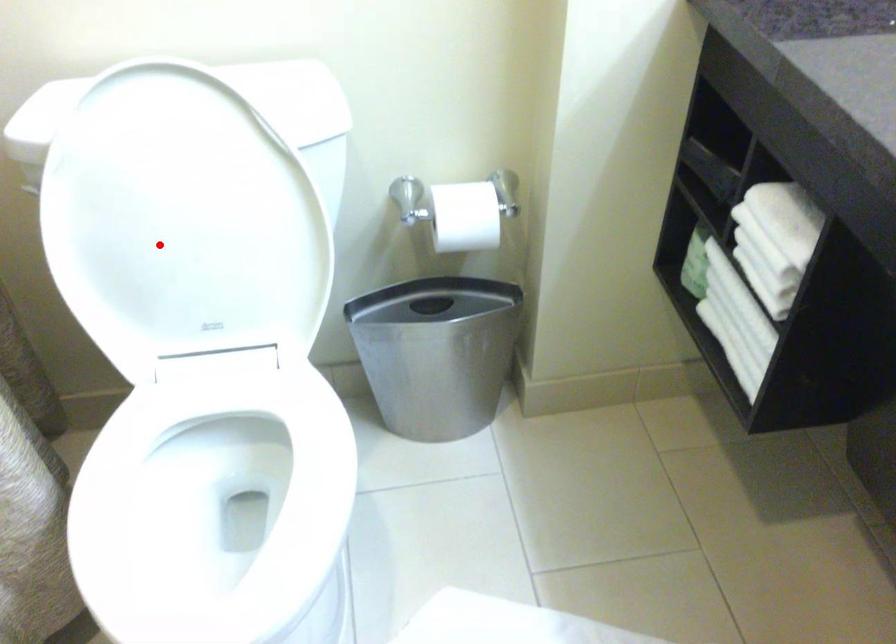
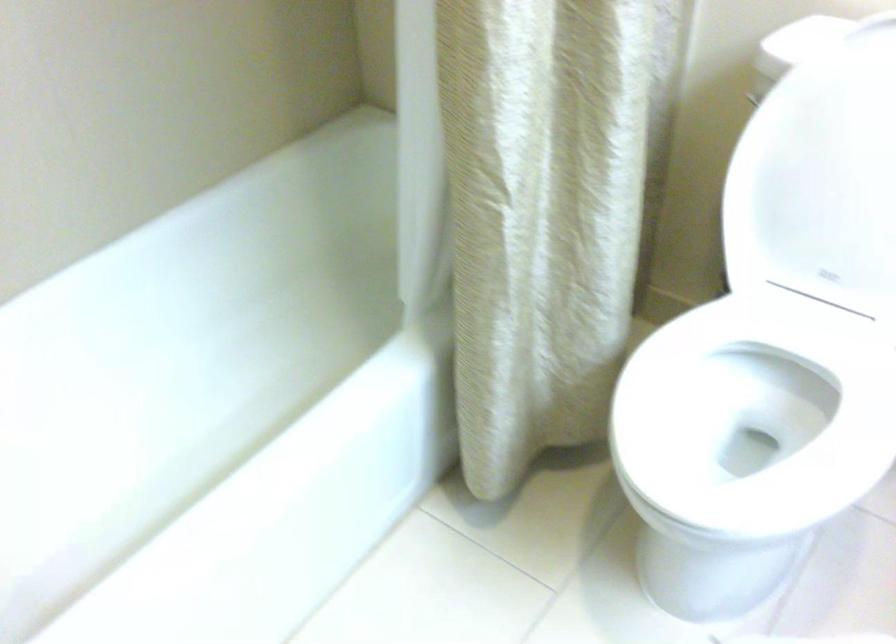
In the second image, find the point that corresponds to the highlighted location in the first image.

(821, 178)